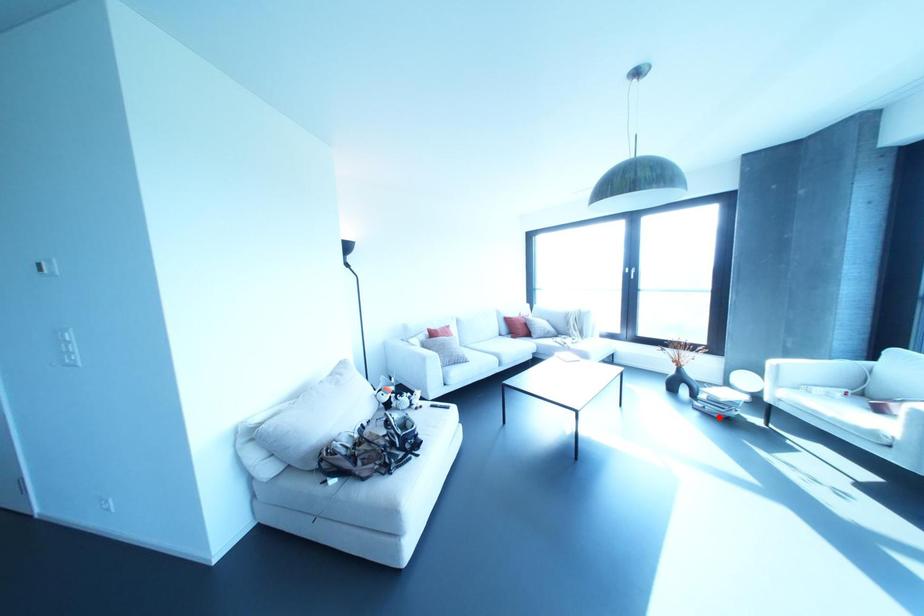
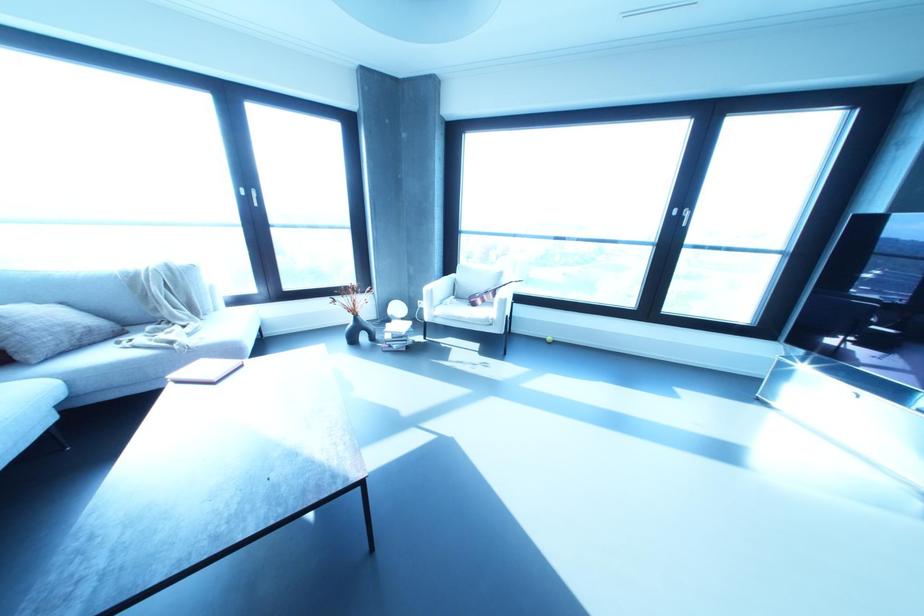
Locate, in the second image, the point that corresponds to the highlighted location in the first image.

(404, 349)